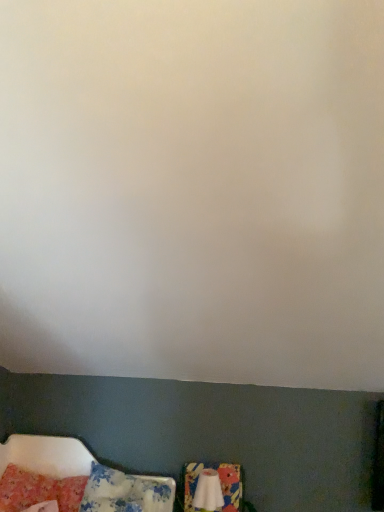
I want to click on fluffy pink pillow at lower left, positioned as the second pillow in right-to-left order, so click(38, 490).

What do you see at coordinates (220, 484) in the screenshot? The height and width of the screenshot is (512, 384). I see `white fabric swivel chair at lower center` at bounding box center [220, 484].

Describe the element at coordinates (126, 492) in the screenshot. I see `fluffy cotton pillow at lower left, which is the second pillow from left to right` at that location.

Looking at this image, what is the approximate height of fluffy cotton pillow at lower left, which is the second pillow from left to right?

fluffy cotton pillow at lower left, which is the second pillow from left to right, is 9.99 inches in height.

At what (x,y) coordinates should I click in order to perform the action: click on fluffy pink pillow at lower left, positioned as the second pillow in right-to-left order. Please return your answer as a coordinate pair (x, y). The image size is (384, 512). Looking at the image, I should click on click(38, 490).

Looking at their sizes, would you say white fabric swivel chair at lower center is wider or thinner than fluffy cotton pillow at lower left, which is the second pillow from left to right?

Clearly, white fabric swivel chair at lower center has less width compared to fluffy cotton pillow at lower left, which is the second pillow from left to right.

From the image's perspective, which one is positioned lower, white fabric swivel chair at lower center or fluffy cotton pillow at lower left, which is the 1th pillow in right-to-left order?

white fabric swivel chair at lower center, from the image's perspective.

Between point (235, 469) and point (155, 497), which one is positioned behind?

The point (235, 469) is more distant.

Consider the image. Does white fabric swivel chair at lower center come behind fluffy cotton pillow at lower left, which is the second pillow from left to right?

Yes, white fabric swivel chair at lower center is behind fluffy cotton pillow at lower left, which is the second pillow from left to right.

Which is in front, point (188, 502) or point (79, 505)?

Positioned in front is point (79, 505).

From the image's perspective, which one is positioned higher, white fabric swivel chair at lower center or fluffy pink pillow at lower left, positioned as the second pillow in right-to-left order?

fluffy pink pillow at lower left, positioned as the second pillow in right-to-left order, is shown above in the image.

Considering the positions of objects white fabric swivel chair at lower center and fluffy pink pillow at lower left, marked as the first pillow in a left-to-right arrangement, in the image provided, who is behind, white fabric swivel chair at lower center or fluffy pink pillow at lower left, marked as the first pillow in a left-to-right arrangement,?

white fabric swivel chair at lower center.

Between fluffy pink pillow at lower left, marked as the first pillow in a left-to-right arrangement, and fluffy cotton pillow at lower left, which is the 1th pillow in right-to-left order, which one has smaller size?

Smaller between the two is fluffy pink pillow at lower left, marked as the first pillow in a left-to-right arrangement.

Is fluffy pink pillow at lower left, marked as the first pillow in a left-to-right arrangement, oriented towards fluffy cotton pillow at lower left, which is the second pillow from left to right?

No, fluffy pink pillow at lower left, marked as the first pillow in a left-to-right arrangement, is not facing towards fluffy cotton pillow at lower left, which is the second pillow from left to right.

Is fluffy pink pillow at lower left, marked as the first pillow in a left-to-right arrangement, wider or thinner than fluffy cotton pillow at lower left, which is the 1th pillow in right-to-left order?

Considering their sizes, fluffy pink pillow at lower left, marked as the first pillow in a left-to-right arrangement, looks slimmer than fluffy cotton pillow at lower left, which is the 1th pillow in right-to-left order.

Would you say fluffy pink pillow at lower left, positioned as the second pillow in right-to-left order, contains white fabric swivel chair at lower center?

Actually, white fabric swivel chair at lower center is outside fluffy pink pillow at lower left, positioned as the second pillow in right-to-left order.

Image resolution: width=384 pixels, height=512 pixels. Identify the location of swivel chair to the right of fluffy pink pillow at lower left, marked as the first pillow in a left-to-right arrangement. (220, 484).

In the scene shown: How different are the orientations of fluffy pink pillow at lower left, marked as the first pillow in a left-to-right arrangement, and white fabric swivel chair at lower center in degrees?

The angle between the facing direction of fluffy pink pillow at lower left, marked as the first pillow in a left-to-right arrangement, and the facing direction of white fabric swivel chair at lower center is 2.09 degrees.

Considering the relative positions of fluffy pink pillow at lower left, positioned as the second pillow in right-to-left order, and white fabric swivel chair at lower center in the image provided, is fluffy pink pillow at lower left, positioned as the second pillow in right-to-left order, to the right of white fabric swivel chair at lower center from the viewer's perspective?

In fact, fluffy pink pillow at lower left, positioned as the second pillow in right-to-left order, is to the left of white fabric swivel chair at lower center.

Which is in front, fluffy cotton pillow at lower left, which is the 1th pillow in right-to-left order, or white fabric swivel chair at lower center?

Positioned in front is fluffy cotton pillow at lower left, which is the 1th pillow in right-to-left order.

Is fluffy cotton pillow at lower left, which is the second pillow from left to right, facing away from white fabric swivel chair at lower center?

That's not correct — fluffy cotton pillow at lower left, which is the second pillow from left to right, is not looking away from white fabric swivel chair at lower center.

Is there a large distance between fluffy cotton pillow at lower left, which is the 1th pillow in right-to-left order, and white fabric swivel chair at lower center?

fluffy cotton pillow at lower left, which is the 1th pillow in right-to-left order, is near white fabric swivel chair at lower center, not far away.

Do you think fluffy cotton pillow at lower left, which is the second pillow from left to right, is within white fabric swivel chair at lower center, or outside of it?

fluffy cotton pillow at lower left, which is the second pillow from left to right, is outside white fabric swivel chair at lower center.

Can you tell me how much fluffy cotton pillow at lower left, which is the second pillow from left to right, and fluffy pink pillow at lower left, positioned as the second pillow in right-to-left order, differ in facing direction?

4.76 degrees.

From the image's perspective, is fluffy cotton pillow at lower left, which is the 1th pillow in right-to-left order, located above or below fluffy pink pillow at lower left, positioned as the second pillow in right-to-left order?

fluffy cotton pillow at lower left, which is the 1th pillow in right-to-left order, is situated lower than fluffy pink pillow at lower left, positioned as the second pillow in right-to-left order, in the image.

From a real-world perspective, who is located higher, fluffy cotton pillow at lower left, which is the second pillow from left to right, or fluffy pink pillow at lower left, marked as the first pillow in a left-to-right arrangement?

fluffy cotton pillow at lower left, which is the second pillow from left to right, is physically above.

Is fluffy cotton pillow at lower left, which is the 1th pillow in right-to-left order, taller or shorter than fluffy pink pillow at lower left, marked as the first pillow in a left-to-right arrangement?

fluffy cotton pillow at lower left, which is the 1th pillow in right-to-left order, is taller than fluffy pink pillow at lower left, marked as the first pillow in a left-to-right arrangement.

I want to click on swivel chair behind the fluffy cotton pillow at lower left, which is the 1th pillow in right-to-left order, so click(220, 484).

From the image's perspective, count 2nd pillows upward from the white fabric swivel chair at lower center and point to it. Please provide its 2D coordinates.

[(38, 490)]

When comparing their distances from white fabric swivel chair at lower center, does fluffy cotton pillow at lower left, which is the second pillow from left to right, or fluffy pink pillow at lower left, positioned as the second pillow in right-to-left order, seem further?

fluffy pink pillow at lower left, positioned as the second pillow in right-to-left order, is further to white fabric swivel chair at lower center.

Considering their positions, is white fabric swivel chair at lower center positioned closer to fluffy cotton pillow at lower left, which is the 1th pillow in right-to-left order, than fluffy pink pillow at lower left, marked as the first pillow in a left-to-right arrangement?

fluffy pink pillow at lower left, marked as the first pillow in a left-to-right arrangement.

Based on their spatial positions, is fluffy pink pillow at lower left, marked as the first pillow in a left-to-right arrangement, or fluffy cotton pillow at lower left, which is the second pillow from left to right, closer to white fabric swivel chair at lower center?

fluffy cotton pillow at lower left, which is the second pillow from left to right, lies closer to white fabric swivel chair at lower center than the other object.

When comparing their distances from fluffy pink pillow at lower left, positioned as the second pillow in right-to-left order, does white fabric swivel chair at lower center or fluffy cotton pillow at lower left, which is the 1th pillow in right-to-left order, seem closer?

Among the two, fluffy cotton pillow at lower left, which is the 1th pillow in right-to-left order, is located nearer to fluffy pink pillow at lower left, positioned as the second pillow in right-to-left order.

Based on their spatial positions, is fluffy cotton pillow at lower left, which is the second pillow from left to right, or white fabric swivel chair at lower center further from fluffy pink pillow at lower left, marked as the first pillow in a left-to-right arrangement?

white fabric swivel chair at lower center is positioned further to the anchor fluffy pink pillow at lower left, marked as the first pillow in a left-to-right arrangement.

Looking at the image, which one is located further to fluffy cotton pillow at lower left, which is the 1th pillow in right-to-left order, fluffy pink pillow at lower left, positioned as the second pillow in right-to-left order, or white fabric swivel chair at lower center?

Based on the image, white fabric swivel chair at lower center appears to be further to fluffy cotton pillow at lower left, which is the 1th pillow in right-to-left order.

This screenshot has width=384, height=512. In order to click on pillow between fluffy pink pillow at lower left, positioned as the second pillow in right-to-left order, and white fabric swivel chair at lower center from left to right in this screenshot , I will do `click(126, 492)`.